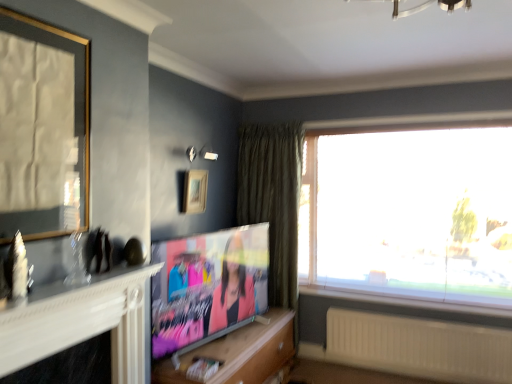
Question: From a real-world perspective, does matte paper magazine at lower center stand above matte black tv at center?

Choices:
 (A) no
 (B) yes

Answer: (A)

Question: Can you confirm if matte paper magazine at lower center is positioned to the right of matte black tv at center?

Choices:
 (A) no
 (B) yes

Answer: (A)

Question: Does matte paper magazine at lower center have a lesser height compared to matte black tv at center?

Choices:
 (A) yes
 (B) no

Answer: (A)

Question: From the image's perspective, is matte paper magazine at lower center on top of matte black tv at center?

Choices:
 (A) yes
 (B) no

Answer: (B)

Question: Is matte paper magazine at lower center closer to the viewer compared to matte black tv at center?

Choices:
 (A) yes
 (B) no

Answer: (A)

Question: From the image's perspective, is matte paper magazine at lower center under matte black tv at center?

Choices:
 (A) no
 (B) yes

Answer: (B)

Question: Is white ribbed radiator at lower right facing away from matte black tv at center?

Choices:
 (A) no
 (B) yes

Answer: (A)

Question: Does white ribbed radiator at lower right have a smaller size compared to matte black tv at center?

Choices:
 (A) no
 (B) yes

Answer: (B)

Question: Does white ribbed radiator at lower right appear on the left side of matte black tv at center?

Choices:
 (A) no
 (B) yes

Answer: (A)

Question: Does white ribbed radiator at lower right turn towards matte black tv at center?

Choices:
 (A) no
 (B) yes

Answer: (A)

Question: From a real-world perspective, is white ribbed radiator at lower right positioned over matte black tv at center based on gravity?

Choices:
 (A) no
 (B) yes

Answer: (A)

Question: From the image's perspective, does white ribbed radiator at lower right appear lower than matte black tv at center?

Choices:
 (A) no
 (B) yes

Answer: (B)

Question: Is wooden picture frame at upper center, which appears as the 1th picture frame when viewed from the right, positioned with its back to white ribbed radiator at lower right?

Choices:
 (A) no
 (B) yes

Answer: (A)